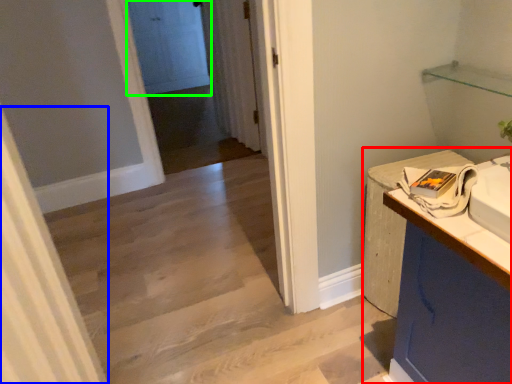
Question: Estimate the real-world distances between objects in this image. Which object is farther from counter (highlighted by a red box), curtain (highlighted by a blue box) or door (highlighted by a green box)?

Choices:
 (A) curtain
 (B) door

Answer: (B)